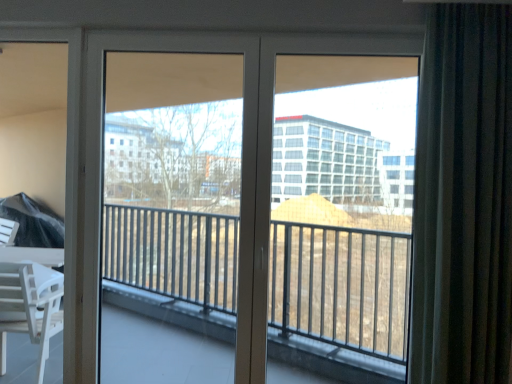
Where is `vacant point above transparent glass window at center (from a real-world perspective)`? This screenshot has height=384, width=512. vacant point above transparent glass window at center (from a real-world perspective) is located at coordinates 352,38.